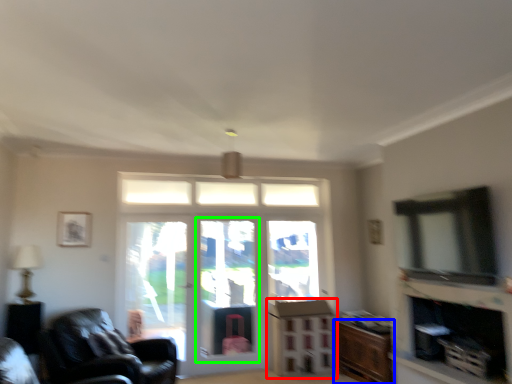
Question: Which object is positioned closest to dresser (highlighted by a red box)? Select from cabinetry (highlighted by a blue box) and screen door (highlighted by a green box).

Choices:
 (A) cabinetry
 (B) screen door

Answer: (A)